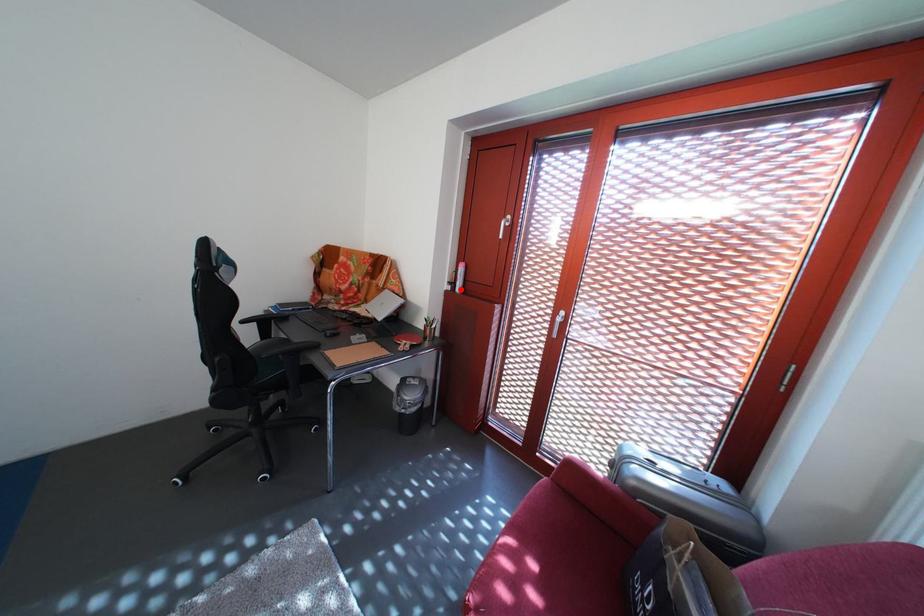
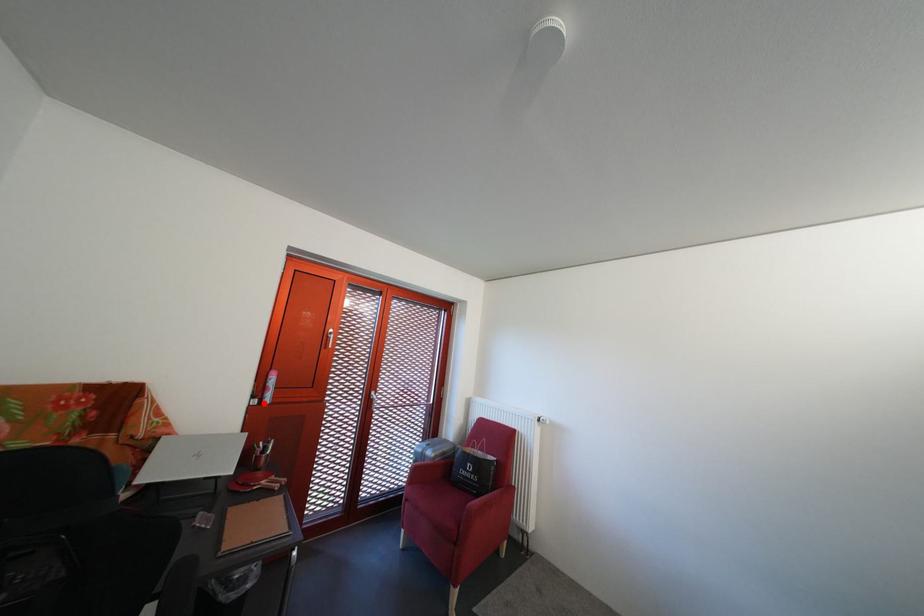
I am providing you with two images of the same scene from different viewpoints. A red point is marked on the first image and another point is marked on the second image. Are the points marked in image1 and image2 representing the same 3D position?

Yes